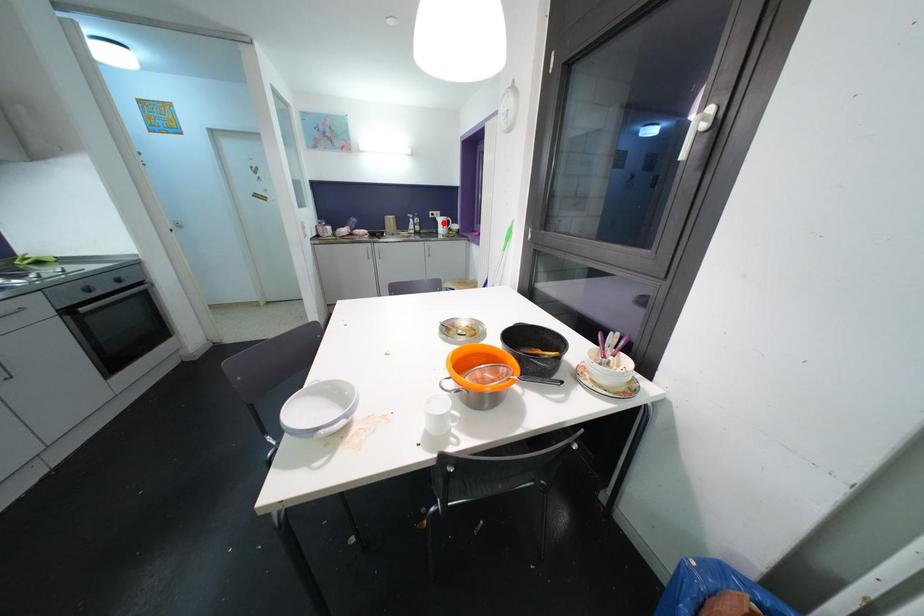
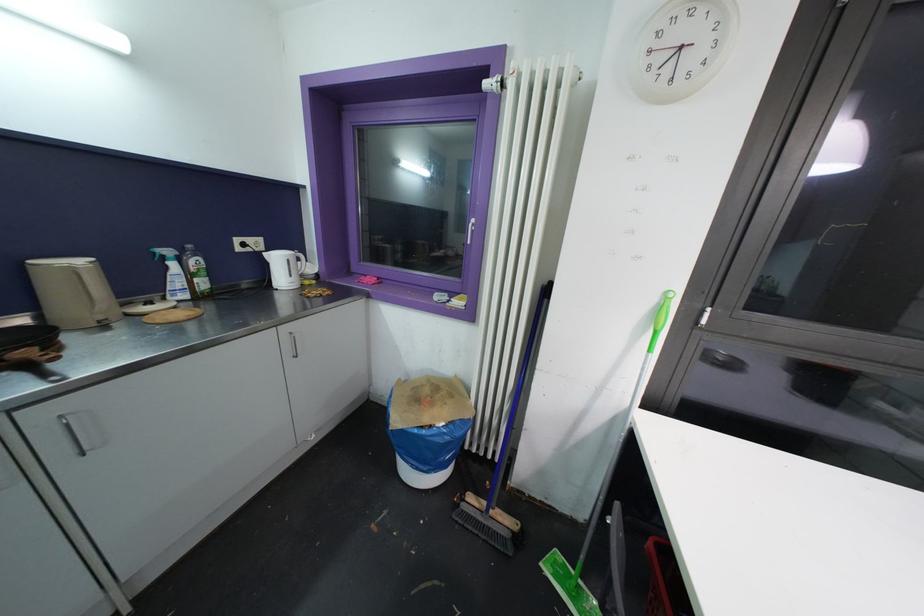
Locate, in the second image, the point that corresponds to the highlighted location in the first image.

(281, 262)